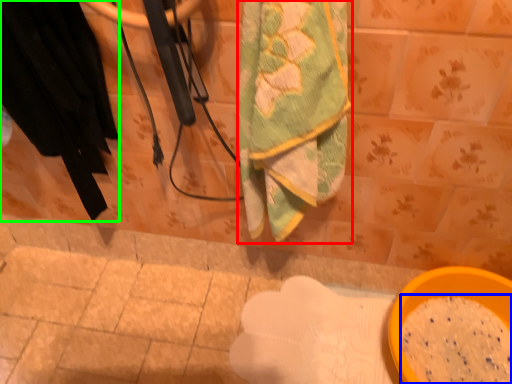
Question: Which is nearer to the towel (highlighted by a red box)? powder (highlighted by a blue box) or clothing (highlighted by a green box).

Choices:
 (A) powder
 (B) clothing

Answer: (B)